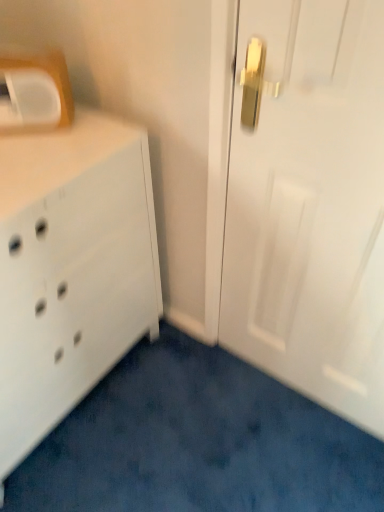
Question: Does white glossy door at center lie in front of white plastic medicine cabinet at upper left?

Choices:
 (A) yes
 (B) no

Answer: (A)

Question: Considering the relative positions of white glossy door at center and white plastic medicine cabinet at upper left in the image provided, is white glossy door at center to the right of white plastic medicine cabinet at upper left from the viewer's perspective?

Choices:
 (A) yes
 (B) no

Answer: (A)

Question: Does white glossy door at center lie behind white plastic medicine cabinet at upper left?

Choices:
 (A) yes
 (B) no

Answer: (B)

Question: Is white glossy door at center taller than white plastic medicine cabinet at upper left?

Choices:
 (A) yes
 (B) no

Answer: (A)

Question: From the image's perspective, does white glossy door at center appear lower than white plastic medicine cabinet at upper left?

Choices:
 (A) no
 (B) yes

Answer: (B)

Question: From a real-world perspective, is white glossy door at center located beneath white plastic medicine cabinet at upper left?

Choices:
 (A) no
 (B) yes

Answer: (B)

Question: Considering the relative sizes of white glossy door at center and white matte chest of drawers at left in the image provided, is white glossy door at center wider than white matte chest of drawers at left?

Choices:
 (A) no
 (B) yes

Answer: (A)

Question: Is white glossy door at center outside of white matte chest of drawers at left?

Choices:
 (A) yes
 (B) no

Answer: (A)

Question: Would you consider white glossy door at center to be distant from white matte chest of drawers at left?

Choices:
 (A) no
 (B) yes

Answer: (A)

Question: Is white glossy door at center positioned before white matte chest of drawers at left?

Choices:
 (A) no
 (B) yes

Answer: (B)

Question: Considering the relative sizes of white glossy door at center and white matte chest of drawers at left in the image provided, is white glossy door at center smaller than white matte chest of drawers at left?

Choices:
 (A) no
 (B) yes

Answer: (B)

Question: From the image's perspective, is white glossy door at center located above white matte chest of drawers at left?

Choices:
 (A) yes
 (B) no

Answer: (A)

Question: From a real-world perspective, does white plastic medicine cabinet at upper left sit lower than white glossy door at center?

Choices:
 (A) yes
 (B) no

Answer: (B)